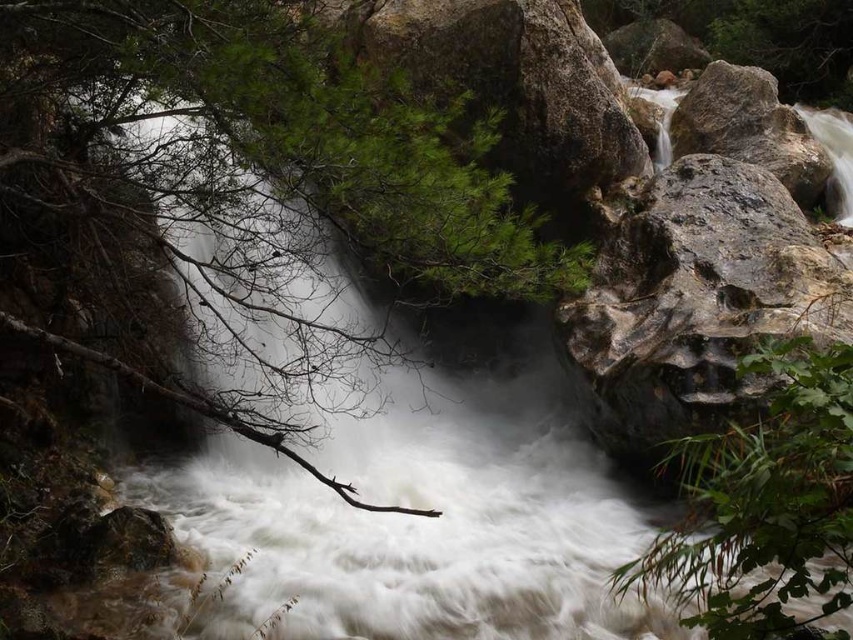
Who is more distant from viewer, (151, 40) or (820, 152)?

The point (820, 152) is behind.

Image resolution: width=853 pixels, height=640 pixels. I want to click on green leafy tree at upper left, so click(267, 163).

Does point (612, 337) come closer to viewer compared to point (734, 77)?

Yes, point (612, 337) is in front of point (734, 77).

Based on the photo, is rough textured rock at right positioned before gray rough rock at right?

Yes.

Is point (616, 321) more distant than point (808, 195)?

No, it is in front of (808, 195).

Image resolution: width=853 pixels, height=640 pixels. I want to click on rough textured rock at right, so click(698, 301).

Consider the image. Does green leafy plant at lower right appear on the left side of gray rough rock at right?

Correct, you'll find green leafy plant at lower right to the left of gray rough rock at right.

Is green leafy plant at lower right smaller than gray rough rock at right?

Yes.

Where is `green leafy plant at lower right`? Image resolution: width=853 pixels, height=640 pixels. green leafy plant at lower right is located at coordinates (764, 504).